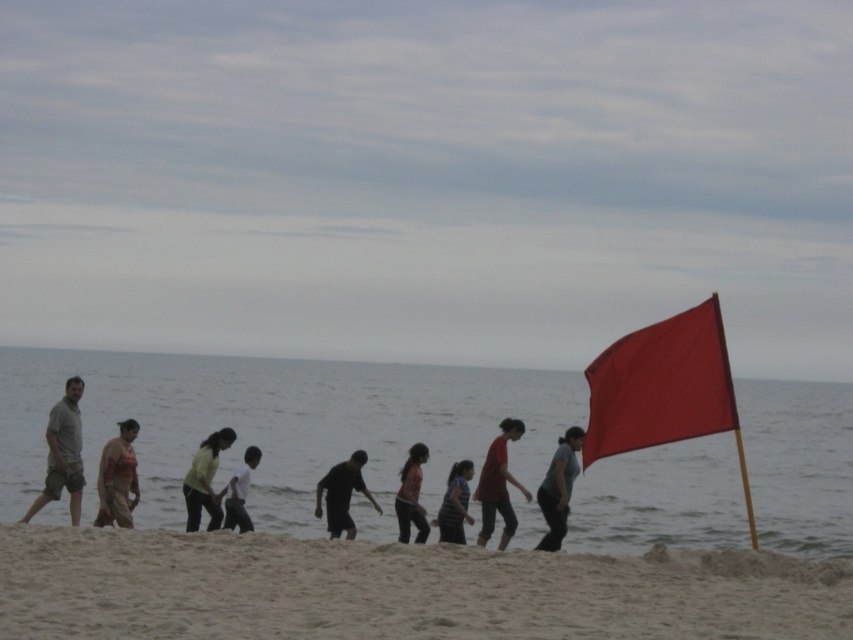
Describe the element at coordinates (660, 385) in the screenshot. The image size is (853, 640). I see `smooth matte red flag at right` at that location.

Is point (605, 387) behind point (572, 464)?

No, (605, 387) is in front of (572, 464).

Who is more forward, [618,416] or [541,540]?

Point [618,416]

Find the location of a particular element. Image resolution: width=853 pixels, height=640 pixels. smooth matte red flag at right is located at coordinates (660, 385).

Which is more to the left, matte red shirt at center or light green fabric shirt at center?

light green fabric shirt at center

Who is more distant from viewer, (486,496) or (215,493)?

Positioned behind is point (486,496).

The width and height of the screenshot is (853, 640). Find the location of `matte red shirt at center`. matte red shirt at center is located at coordinates (498, 484).

The height and width of the screenshot is (640, 853). Find the location of `matte red shirt at center`. matte red shirt at center is located at coordinates (498, 484).

Which is more to the left, smooth matte red flag at right or white matte shirt at center?

white matte shirt at center is more to the left.

Is smooth matte red flag at right taller than white matte shirt at center?

Yes.

Which is in front, point (621, 417) or point (231, 525)?

Point (621, 417) is more forward.

Where is `smooth matte red flag at right`? The image size is (853, 640). smooth matte red flag at right is located at coordinates (660, 385).